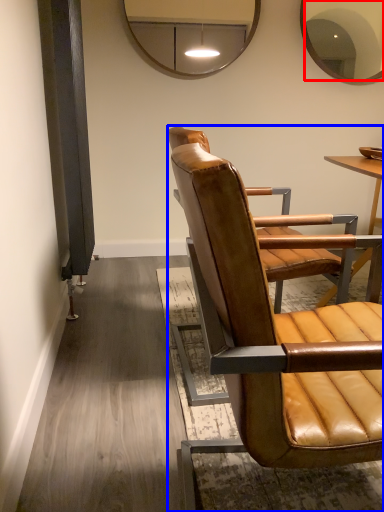
Question: Among these objects, which one is nearest to the camera, mirror (highlighted by a red box) or chair (highlighted by a blue box)?

Choices:
 (A) mirror
 (B) chair

Answer: (B)